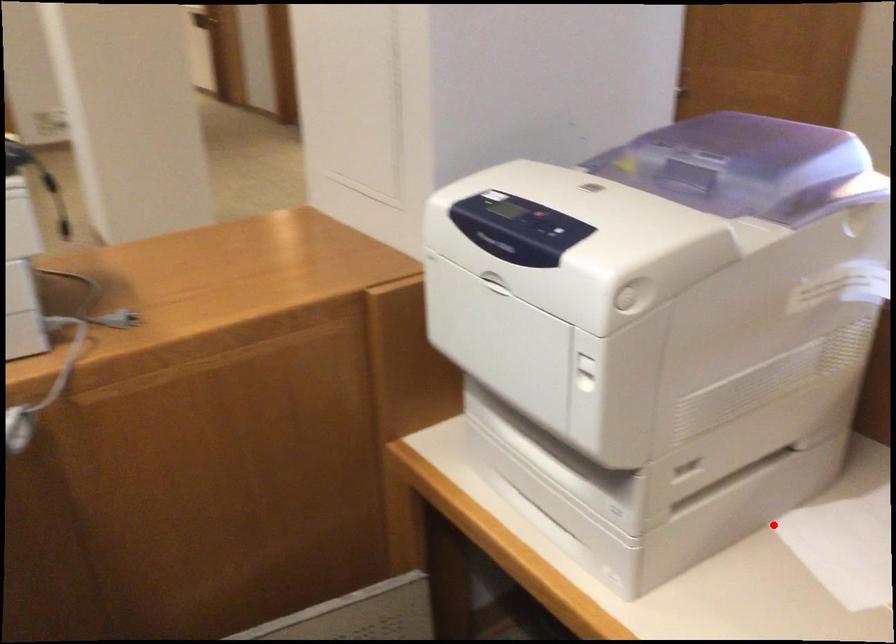
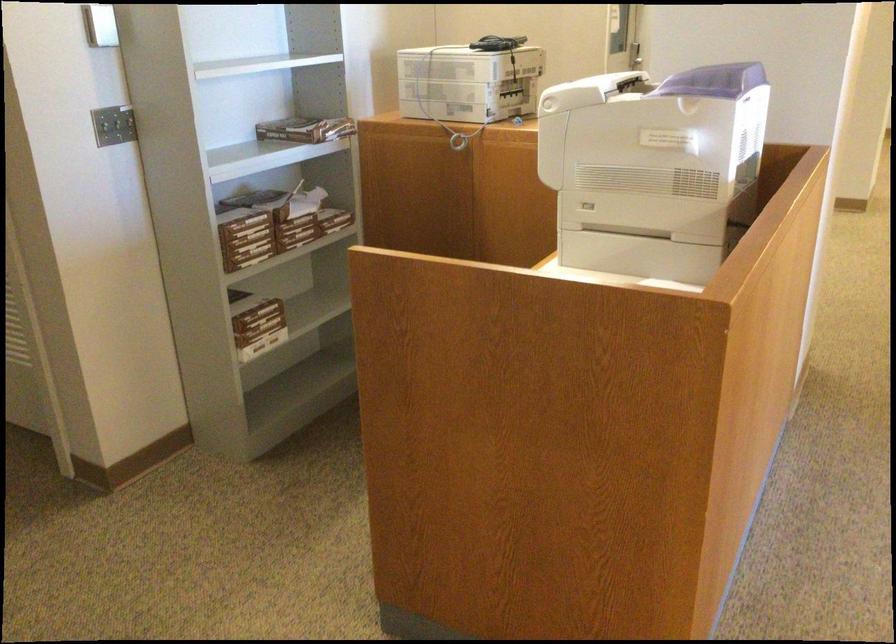
Where in the second image is the point corresponding to the highlighted location from the first image?

(640, 254)